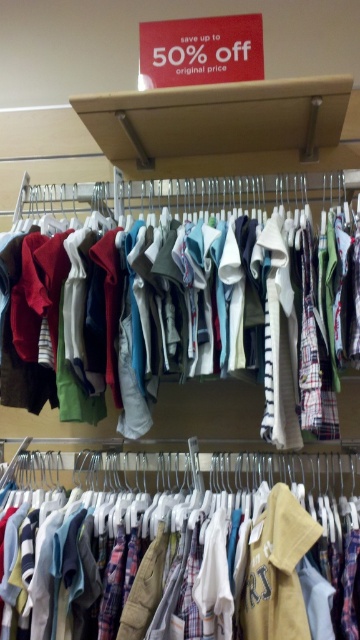
Is plaid fabric shirts at center positioned behind matte cotton shorts at center?

No, plaid fabric shirts at center is in front of matte cotton shorts at center.

Who is higher up, plaid fabric shirts at center or matte cotton shorts at center?

Positioned higher is matte cotton shorts at center.

Who is more distant from viewer, (286, 504) or (6, 416)?

Positioned behind is point (6, 416).

Locate an element on the screen. This screenshot has width=360, height=640. plaid fabric shirts at center is located at coordinates (182, 544).